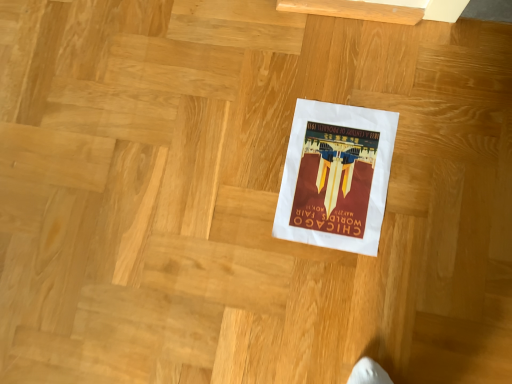
At what (x,y) coordinates should I click in order to perform the action: click on free space underneath white paper poster at center (from a real-world perspective). Please return your answer as a coordinate pair (x, y). This screenshot has height=384, width=512. Looking at the image, I should click on (337, 176).